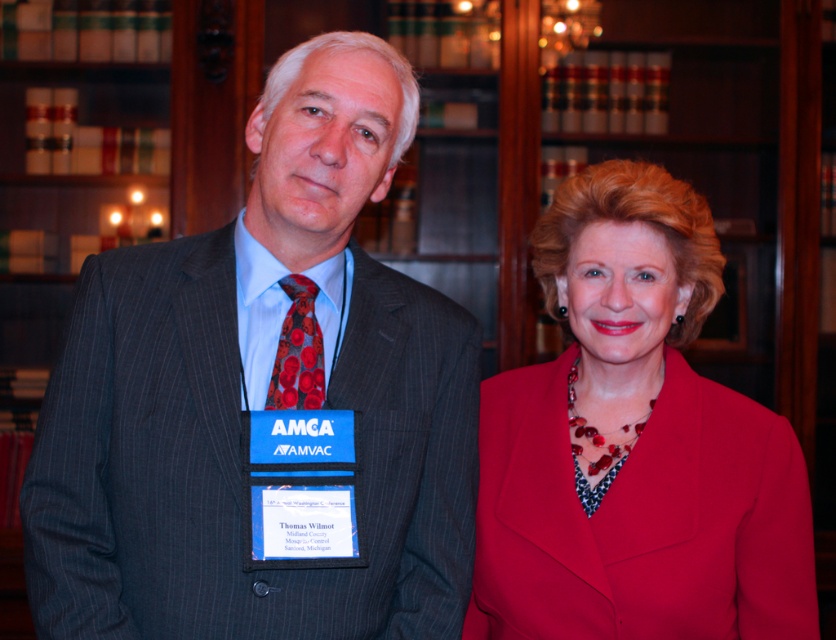
Question: Which point appears farthest from the camera in this image?

Choices:
 (A) (405, 144)
 (B) (311, 300)

Answer: (A)

Question: Can you confirm if matte red coat at right is positioned above red satin tie at center?

Choices:
 (A) yes
 (B) no

Answer: (B)

Question: Which of the following is the closest to the observer?

Choices:
 (A) gray pinstripe suit at center
 (B) matte red coat at right

Answer: (A)

Question: Which object is farther from the camera taking this photo?

Choices:
 (A) matte red coat at right
 (B) red satin tie at center

Answer: (A)

Question: Is gray pinstripe suit at center bigger than matte red coat at right?

Choices:
 (A) no
 (B) yes

Answer: (B)

Question: Is gray pinstripe suit at center further to the viewer compared to matte red coat at right?

Choices:
 (A) no
 (B) yes

Answer: (A)